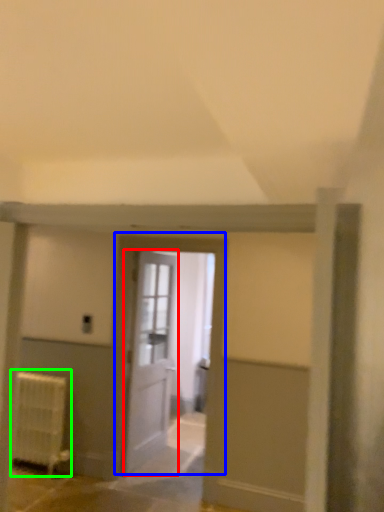
Question: Considering the real-world distances, which object is closest to door (highlighted by a red box)? door (highlighted by a blue box) or radiator (highlighted by a green box).

Choices:
 (A) door
 (B) radiator

Answer: (A)